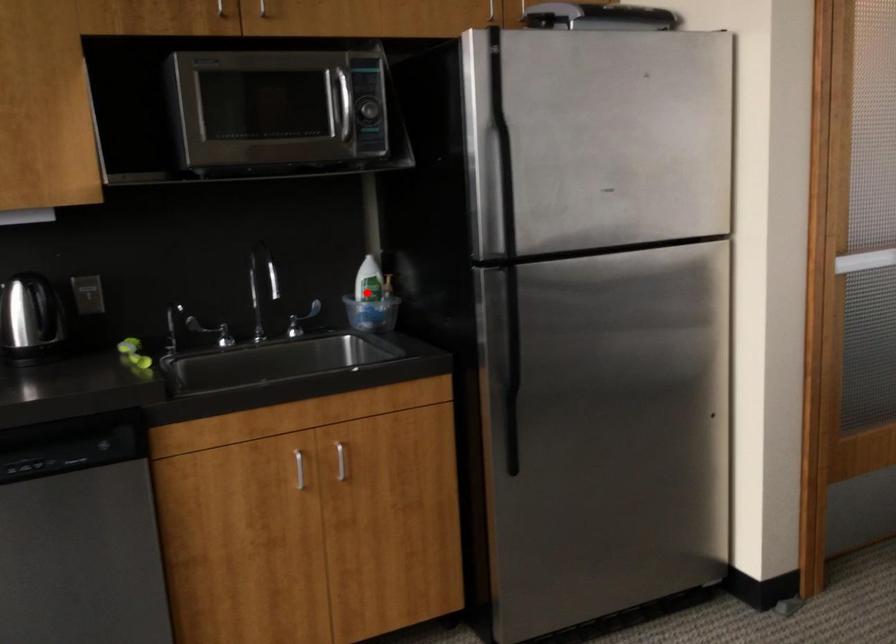
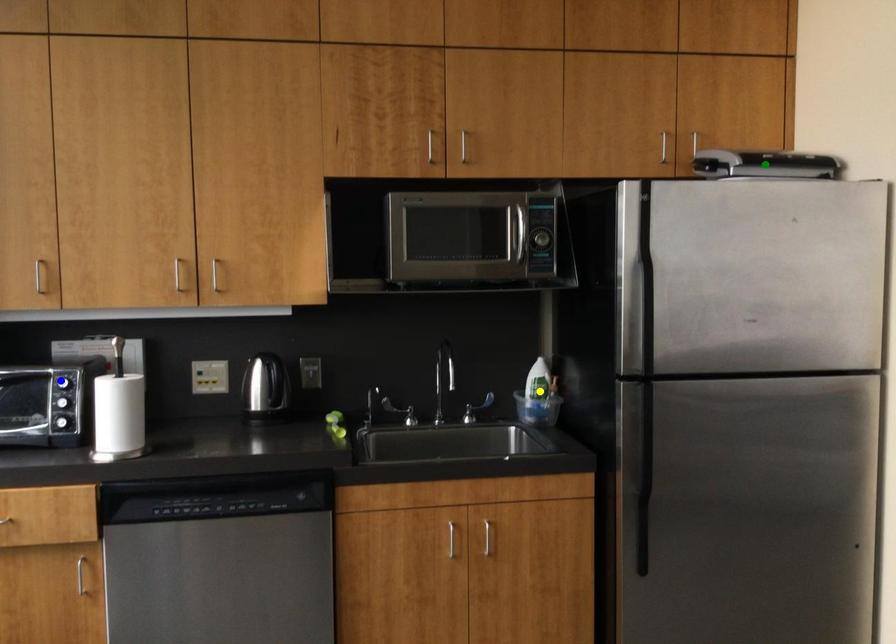
Question: I am providing you with two images of the same scene from different viewpoints. A red point is marked on the first image. You are given multiple points on the second image. Can you choose the point in image 2 that corresponds to the point in image 1?

Choices:
 (A) yellow point
 (B) blue point
 (C) green point

Answer: (A)